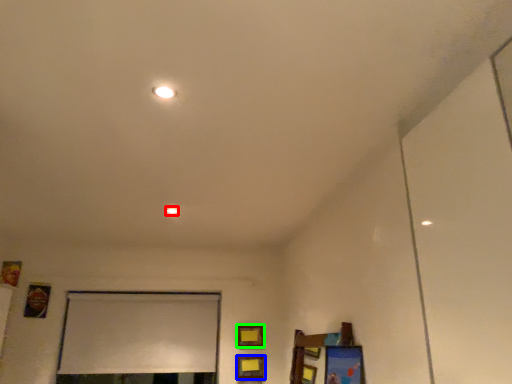
Question: Which object is the farthest from light (highlighted by a red box)? Choose among these: picture frame (highlighted by a blue box) or picture frame (highlighted by a green box).

Choices:
 (A) picture frame
 (B) picture frame

Answer: (A)